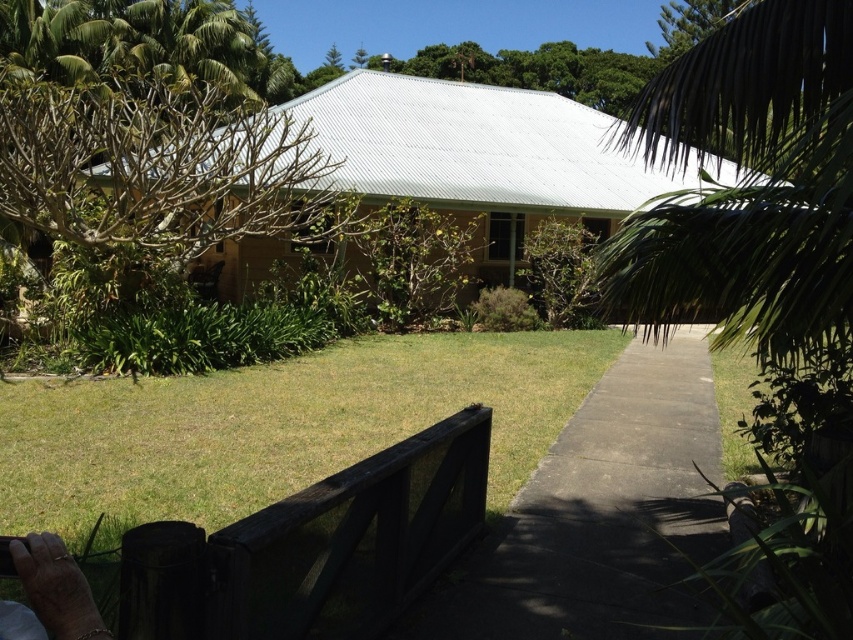
Question: Can you confirm if green grass at center is bigger than concrete at center?

Choices:
 (A) yes
 (B) no

Answer: (B)

Question: Which point appears closest to the camera in this image?

Choices:
 (A) (648, 451)
 (B) (447, 380)

Answer: (A)

Question: Observing the image, what is the correct spatial positioning of green grass at center in reference to concrete at center?

Choices:
 (A) right
 (B) left

Answer: (B)

Question: Is green grass at center closer to the viewer compared to concrete at center?

Choices:
 (A) yes
 (B) no

Answer: (B)

Question: Which point is farther to the camera?

Choices:
 (A) green grass at center
 (B) concrete at center

Answer: (A)

Question: Among these points, which one is nearest to the camera?

Choices:
 (A) (669, 512)
 (B) (335, 392)

Answer: (A)